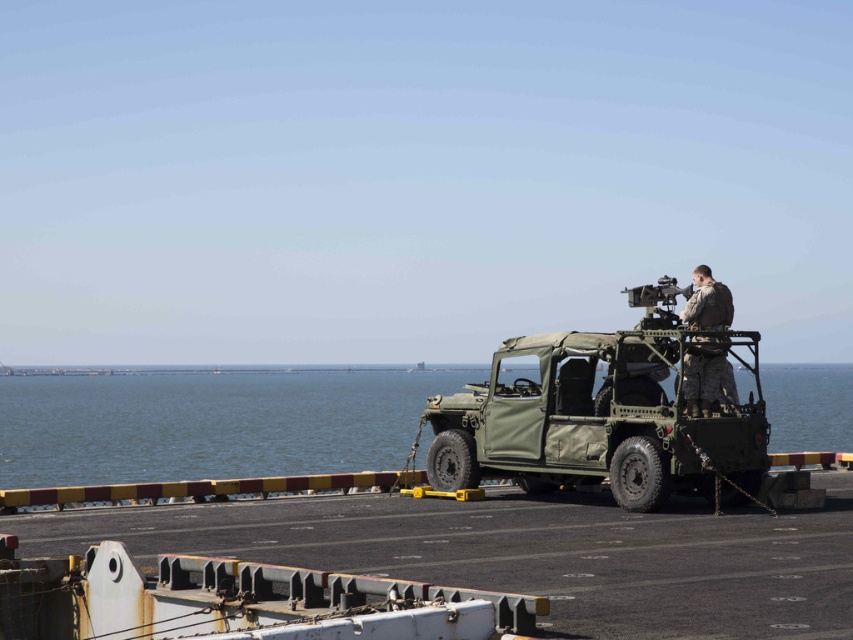
Does green matte jeep at center have a greater height compared to camouflage fabric uniform at center?

Indeed, green matte jeep at center has a greater height compared to camouflage fabric uniform at center.

The image size is (853, 640). I want to click on green matte jeep at center, so click(602, 413).

Can you confirm if green matte water at center is positioned to the left of green matte jeep at center?

Yes, green matte water at center is to the left of green matte jeep at center.

Is green matte water at center shorter than green matte jeep at center?

In fact, green matte water at center may be taller than green matte jeep at center.

Between point (343, 374) and point (432, 410), which one is positioned in front?

Point (432, 410)

Identify the location of green matte water at center. The image size is (853, 640). (209, 424).

Can you confirm if green matte water at center is positioned to the right of camouflage fabric uniform at center?

In fact, green matte water at center is to the left of camouflage fabric uniform at center.

Is green matte water at center behind camouflage fabric uniform at center?

No, green matte water at center is in front of camouflage fabric uniform at center.

Between point (251, 433) and point (722, 321), which one is positioned in front?

Point (722, 321)

Locate an element on the screen. green matte water at center is located at coordinates (209, 424).